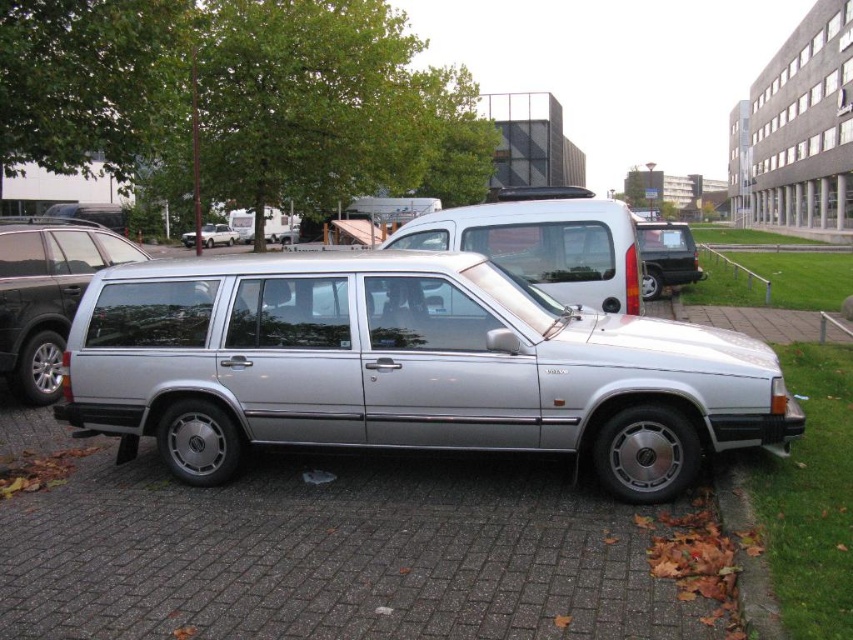
Does silver metallic minivan at left have a lesser width compared to matte black suv at right?

Yes.

Is point (33, 348) positioned in front of point (676, 262)?

Yes, it is in front of point (676, 262).

Between point (44, 397) and point (689, 252), which one is positioned behind?

The point (689, 252) is behind.

Where is `silver metallic minivan at left`? This screenshot has width=853, height=640. silver metallic minivan at left is located at coordinates (45, 292).

Does silver metallic station wagon at center appear under satin silver station wagon at center?

Correct, silver metallic station wagon at center is located below satin silver station wagon at center.

From the picture: Is silver metallic station wagon at center taller than satin silver station wagon at center?

Correct, silver metallic station wagon at center is much taller as satin silver station wagon at center.

Does point (537, 432) come farther from viewer compared to point (186, 244)?

No.

You are a GUI agent. You are given a task and a screenshot of the screen. Output one action in this format:
    pyautogui.click(x=<x>, y=<y>)
    Task: Click on the silver metallic station wagon at center
    This screenshot has width=853, height=640.
    Given the screenshot: What is the action you would take?
    pyautogui.click(x=405, y=368)

From the picture: Who is more forward, (236, 360) or (650, 278)?

Positioned in front is point (236, 360).

In order to click on silver metallic station wagon at center in this screenshot , I will do `click(405, 368)`.

This screenshot has height=640, width=853. Identify the location of silver metallic station wagon at center. (405, 368).